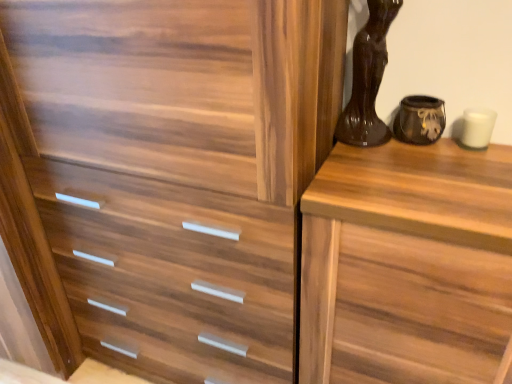
You are a GUI agent. You are given a task and a screenshot of the screen. Output one action in this format:
    pyautogui.click(x=<x>, y=<y>)
    Task: Click on the free spot below shiny brown vase at upper right, which is the 2th vase in right-to-left order (from a real-world perspective)
    This screenshot has height=384, width=512.
    Given the screenshot: What is the action you would take?
    pyautogui.click(x=367, y=146)